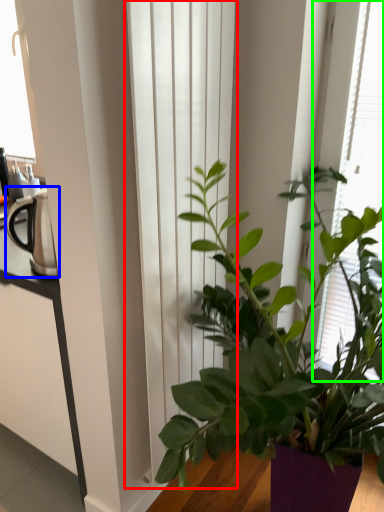
Question: Considering the real-world distances, which object is closest to curtain (highlighted by a red box)? appliance (highlighted by a blue box) or bay window (highlighted by a green box).

Choices:
 (A) appliance
 (B) bay window

Answer: (A)